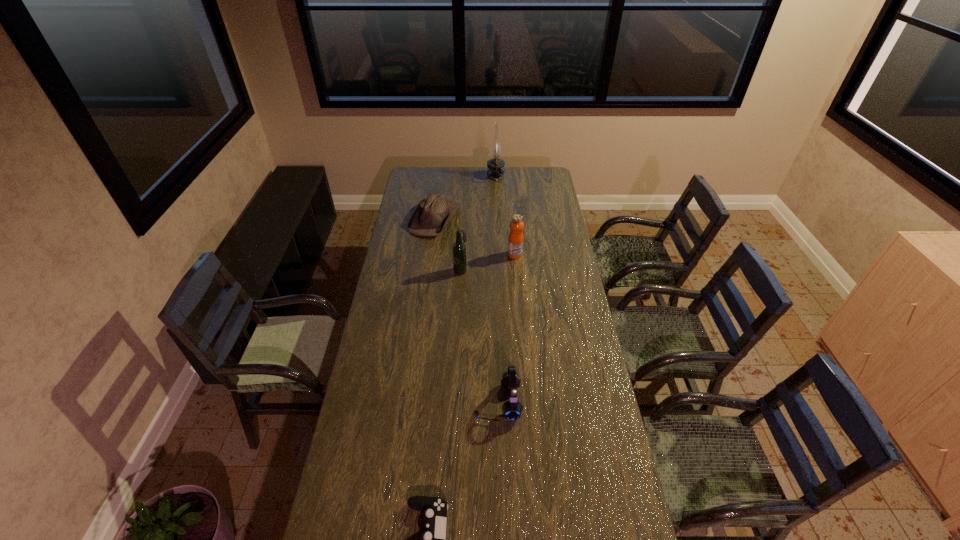
The image size is (960, 540). Find the location of `free location at the far left corner`. free location at the far left corner is located at coordinates (430, 181).

What are the coordinates of `vacant region between the fifth tallest object and the fourth tallest object` in the screenshot? It's located at (467, 310).

Find the location of a particular element. This screenshot has height=540, width=960. free point between the fruit juice and the farthest object is located at coordinates (505, 216).

Where is `empty space between the fruit juice and the oil lamp`? This screenshot has width=960, height=540. empty space between the fruit juice and the oil lamp is located at coordinates (505, 216).

Locate an element on the screen. Image resolution: width=960 pixels, height=540 pixels. vacant space that is in between the headset and the third farthest object is located at coordinates (507, 328).

Identify the location of free space between the fruit juice and the fourth farthest object. (488, 262).

In order to click on unoccupied area between the fourth farthest object and the fourth tallest object in this screenshot , I will do `click(479, 336)`.

You are a GUI agent. You are given a task and a screenshot of the screen. Output one action in this format:
    pyautogui.click(x=<x>, y=<y>)
    Task: Click on the vacant point located between the oil lamp and the fifth tallest object
    This screenshot has width=960, height=540.
    Given the screenshot: What is the action you would take?
    pyautogui.click(x=466, y=198)

Find the location of `object that can be found as the fifth closest to the third farthest object`. object that can be found as the fifth closest to the third farthest object is located at coordinates (433, 539).

At what (x,y) coordinates should I click in order to perform the action: click on object that stands as the fourth closest to the fruit juice. Please return your answer as a coordinate pair (x, y). Looking at the image, I should click on (512, 409).